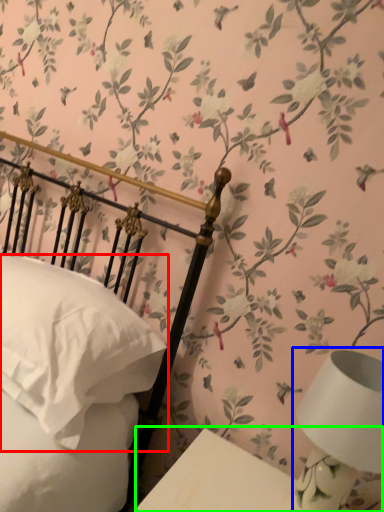
Question: Estimate the real-world distances between objects in this image. Which object is farther from pillow (highlighted by a red box), table lamp (highlighted by a blue box) or table (highlighted by a green box)?

Choices:
 (A) table lamp
 (B) table

Answer: (A)